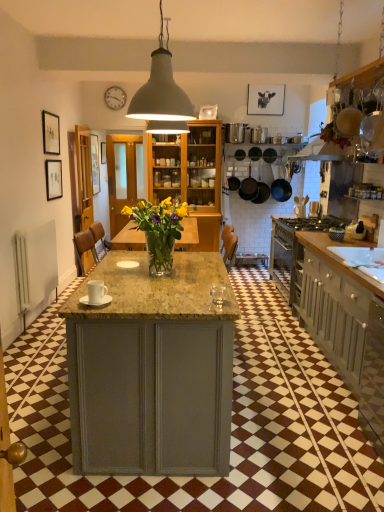
Question: Are matte black frying pan at upper right, the 1th frying pan from the front, and matte black picture frame at left, which is the 4th picture frame in top-to-bottom order, making contact?

Choices:
 (A) yes
 (B) no

Answer: (B)

Question: Does matte black frying pan at upper right, the 1th frying pan from the front, have a smaller size compared to matte black picture frame at left, the third picture frame in the back-to-front sequence?

Choices:
 (A) no
 (B) yes

Answer: (A)

Question: Is matte black frying pan at upper right, the 1th frying pan from the front, thinner than matte black picture frame at left, which is the 4th picture frame in top-to-bottom order?

Choices:
 (A) yes
 (B) no

Answer: (B)

Question: Can you confirm if matte black frying pan at upper right, the 1th frying pan from the front, is wider than matte black picture frame at left, the third picture frame in the back-to-front sequence?

Choices:
 (A) no
 (B) yes

Answer: (B)

Question: From the image's perspective, does matte black frying pan at upper right, the 1th frying pan from the front, appear lower than matte black picture frame at left, the 1th picture frame from the bottom?

Choices:
 (A) yes
 (B) no

Answer: (B)

Question: From the image's perspective, is matte black frying pan at center, placed as the fourth frying pan when sorted from front to back, located above or below matte black picture frame at upper left, the third picture frame when ordered from top to bottom?

Choices:
 (A) below
 (B) above

Answer: (A)

Question: Which is correct: matte black frying pan at center, which appears as the 1th frying pan when viewed from the back, is inside matte black picture frame at upper left, which appears as the 4th picture frame when viewed from the back, or outside of it?

Choices:
 (A) outside
 (B) inside

Answer: (A)

Question: Would you say matte black frying pan at center, placed as the fourth frying pan when sorted from front to back, is to the left or to the right of matte black picture frame at upper left, which appears as the 4th picture frame when viewed from the back, in the picture?

Choices:
 (A) left
 (B) right

Answer: (B)

Question: From a real-world perspective, is matte black frying pan at center, which appears as the 1th frying pan when viewed from the back, positioned above or below matte black picture frame at upper left, the third picture frame when ordered from top to bottom?

Choices:
 (A) above
 (B) below

Answer: (B)

Question: From the image's perspective, relative to black matte frying pan at center, the 3th frying pan from the front, is matte gray cabinet at right above or below?

Choices:
 (A) below
 (B) above

Answer: (A)

Question: In terms of height, does matte gray cabinet at right look taller or shorter compared to black matte frying pan at center, arranged as the 2th frying pan when viewed from the back?

Choices:
 (A) tall
 (B) short

Answer: (A)

Question: From a real-world perspective, is matte gray cabinet at right above or below black matte frying pan at center, the 3th frying pan from the front?

Choices:
 (A) above
 (B) below

Answer: (B)

Question: Considering their positions, is matte gray cabinet at right located in front of or behind black matte frying pan at center, the 3th frying pan from the front?

Choices:
 (A) behind
 (B) front

Answer: (B)

Question: From the image's perspective, is dark brown matte frying pan at center, arranged as the 2th frying pan when viewed from the front, located above or below matte black cow portrait at upper center, the 4th picture frame when ordered from left to right?

Choices:
 (A) above
 (B) below

Answer: (B)

Question: From a real-world perspective, is dark brown matte frying pan at center, acting as the third frying pan starting from the back, above or below matte black cow portrait at upper center, the 4th picture frame when ordered from left to right?

Choices:
 (A) above
 (B) below

Answer: (B)